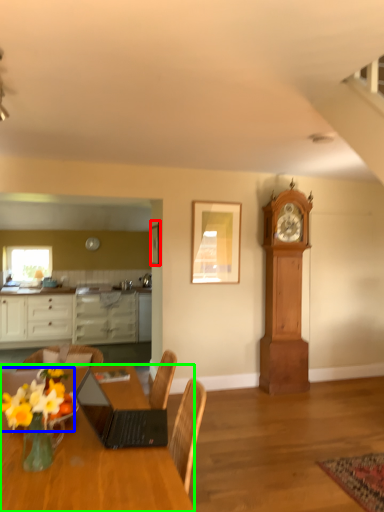
Question: Which is farther away from picture frame (highlighted by a red box)? flower (highlighted by a blue box) or desk (highlighted by a green box)?

Choices:
 (A) flower
 (B) desk

Answer: (A)